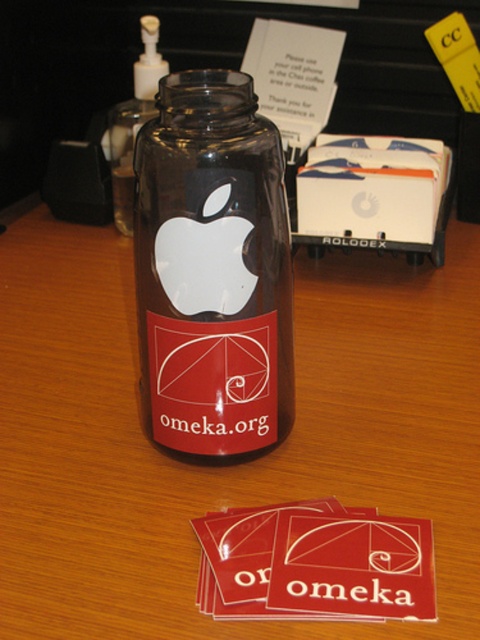
You are a delivery person who needs to place a box on the wooden table at center. The box is 12 inches wide. Can you place it on the table without touching the transparent glass bottle at center?

The wooden table at center and transparent glass bottle at center are 11.34 inches apart. Since the box is 12 inches wide, it would not fit between them without overlapping, so you cannot place the box on the table without touching the transparent glass bottle at center.

You are a delivery person who needs to place a heavy box on the surface that can support it. Based on the scene, which object between the wooden table at center and the transparent glass bottle at center is more likely to support the box?

The wooden table at center is more likely to support the box since it has a lesser height compared to the transparent glass bottle at center, implying it is sturdier and more stable for heavy items.